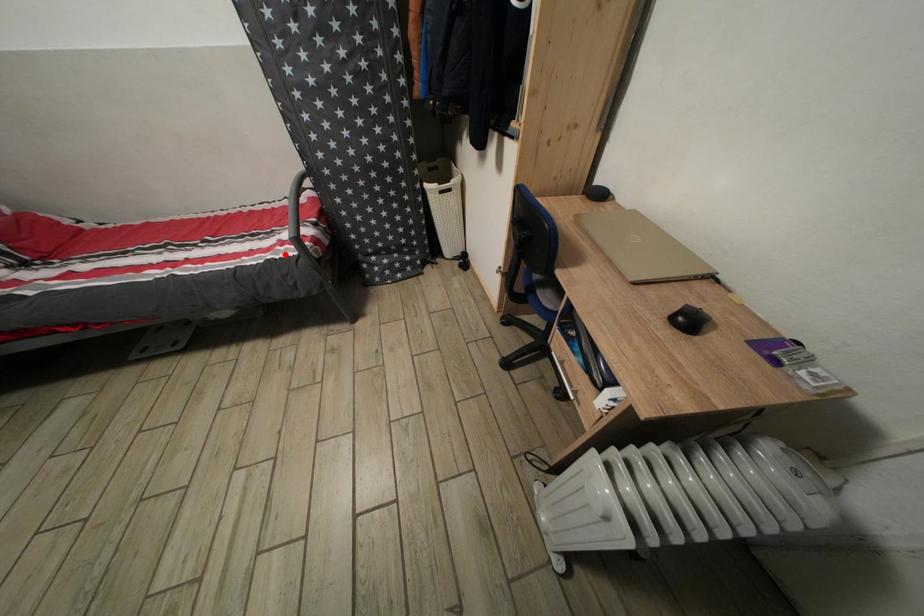
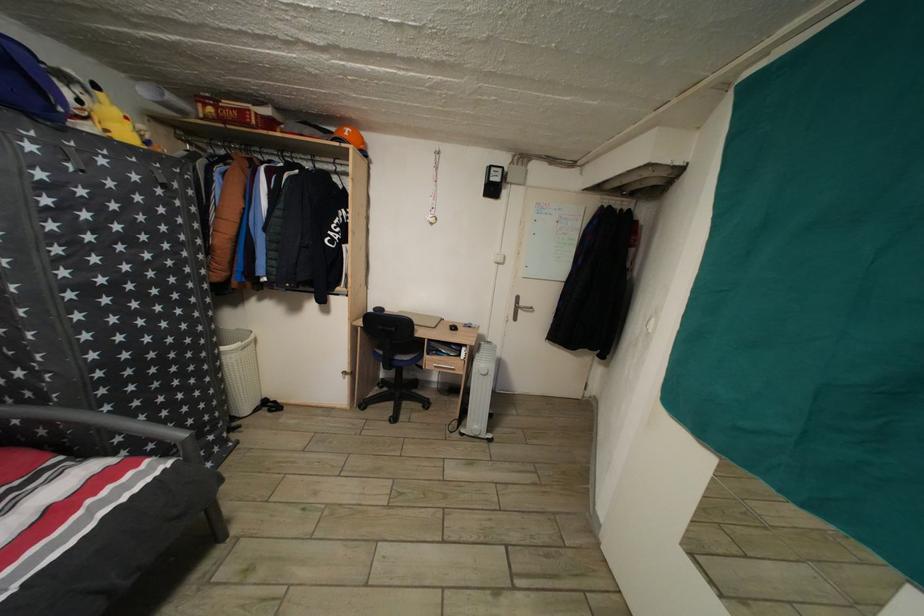
Where in the second image is the point corresponding to the highlighted location from the first image?

(96, 508)